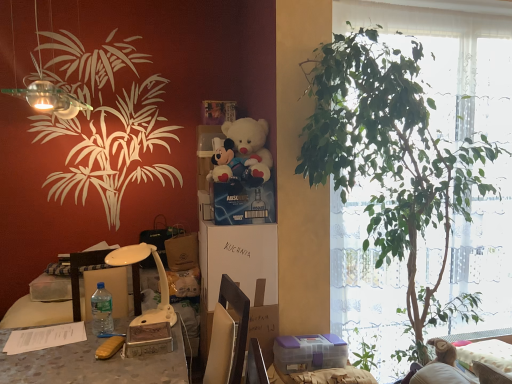
Question: Is point (250, 332) closer or farther from the camera than point (163, 243)?

Choices:
 (A) closer
 (B) farther

Answer: (A)

Question: From a real-world perspective, relative to brown paper bag at center, arranged as the first box when viewed from the back, is cardboard box at center vertically above or below?

Choices:
 (A) below
 (B) above

Answer: (A)

Question: Estimate the real-world distances between objects in this image. Which object is closer to the velvet pink couch at lower right?

Choices:
 (A) cardboard box at center
 (B) brown paper bag at center, positioned as the 4th box in front-to-back order
 (C) white plastic lamp at lower left, the first lamp ordered from the bottom
 (D) blue cardboard box at center, marked as the second box in a back-to-front arrangement
 (E) transparent glass lamp at upper left, arranged as the first lamp when viewed from the front

Answer: (A)

Question: Estimate the real-world distances between objects in this image. Which object is closer to the clear plastic bottle at lower left?

Choices:
 (A) white plastic lamp at lower left, the first lamp ordered from the bottom
 (B) cardboard box at center
 (C) green leafy plant at right
 (D) white plush teddy bear at center
 (E) purple plastic container at lower center, the 4th box viewed from the top

Answer: (A)